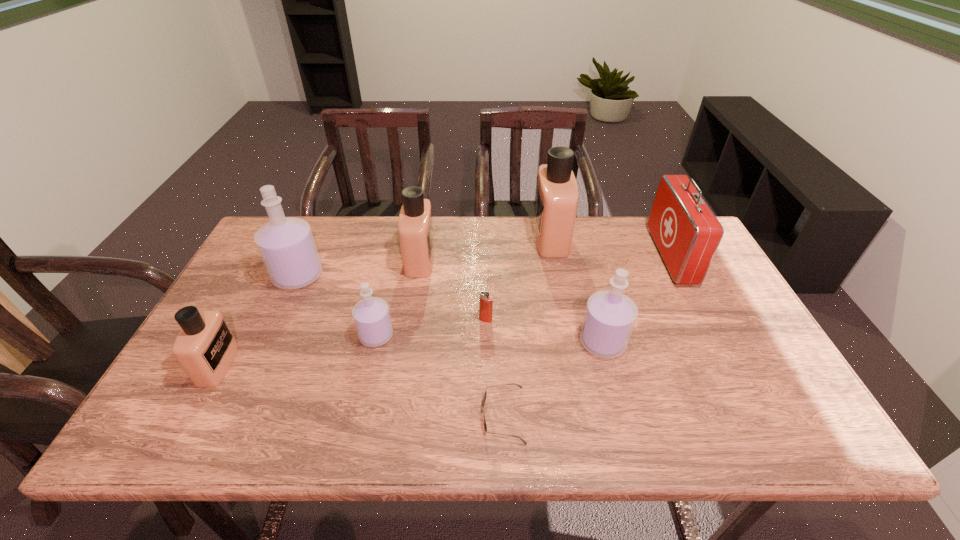
Identify the location of the fifth closest object relative to the black sunglasses. click(556, 200).

Choose which perfume is the fourth nearest neighbor to the second beige perfume from left to right. Please provide its 2D coordinates. Your answer should be formatted as a tuple, i.e. [(x, y)], where the tuple contains the x and y coordinates of a point satisfying the conditions above.

[(609, 318)]

The image size is (960, 540). I want to click on the second closest perfume to the black sunglasses, so click(371, 315).

Identify which beige perfume is the nearest to the smallest purple perfume. Please provide its 2D coordinates. Your answer should be formatted as a tuple, i.e. [(x, y)], where the tuple contains the x and y coordinates of a point satisfying the conditions above.

[(415, 224)]

Select which beige perfume appears as the second closest to the first-aid kit. Please provide its 2D coordinates. Your answer should be formatted as a tuple, i.e. [(x, y)], where the tuple contains the x and y coordinates of a point satisfying the conditions above.

[(415, 224)]

In order to click on purple perfume that is the closest to the nearest beige perfume in this screenshot , I will do `click(286, 244)`.

Where is `purple perfume that is the second closest one to the rightmost beige perfume`? Image resolution: width=960 pixels, height=540 pixels. purple perfume that is the second closest one to the rightmost beige perfume is located at coordinates (371, 315).